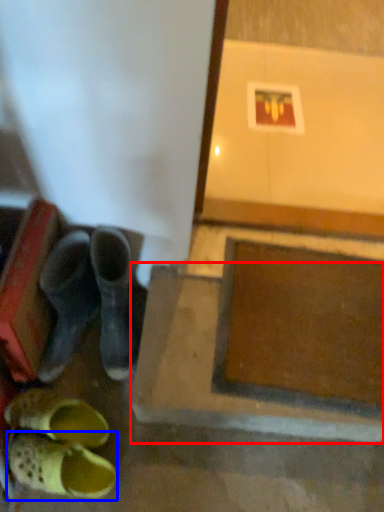
Question: Which of the following is the farthest to the observer, concrete (highlighted by a red box) or footwear (highlighted by a blue box)?

Choices:
 (A) concrete
 (B) footwear

Answer: (A)